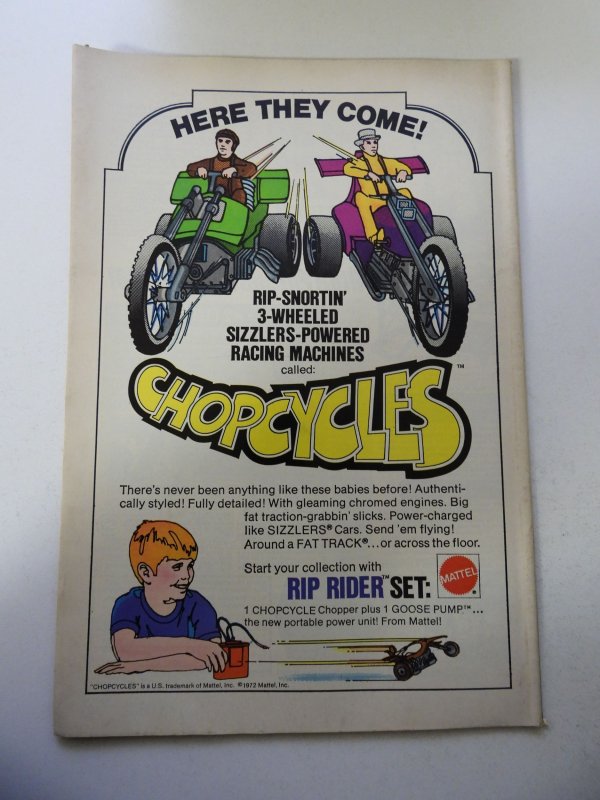
The width and height of the screenshot is (600, 800). Find the location of `wall`. wall is located at coordinates (23, 764).